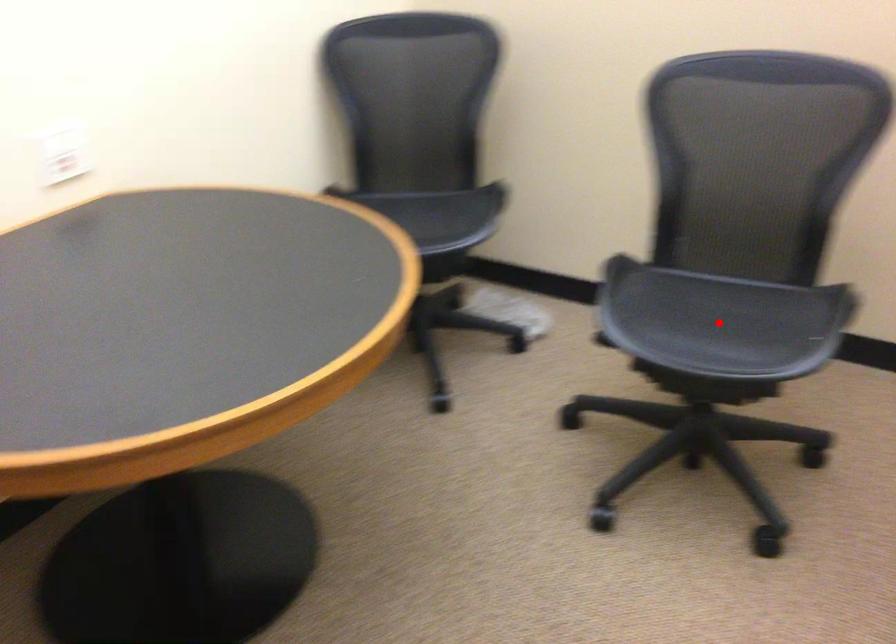
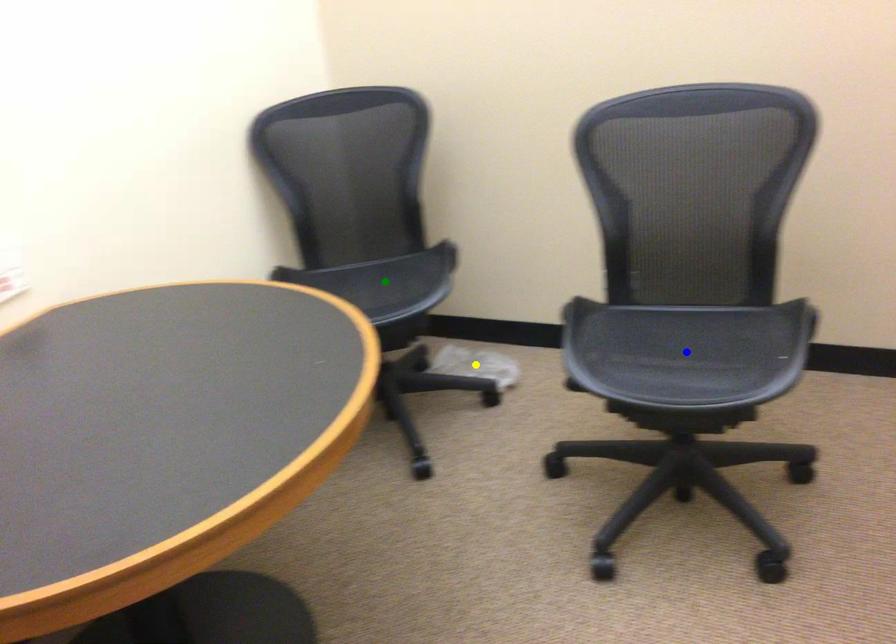
Question: I am providing you with two images of the same scene from different viewpoints. A red point is marked on the first image. You are given multiple points on the second image. Which point in image 2 represents the same 3d spot as the red point in image 1?

Choices:
 (A) green point
 (B) yellow point
 (C) blue point

Answer: (C)